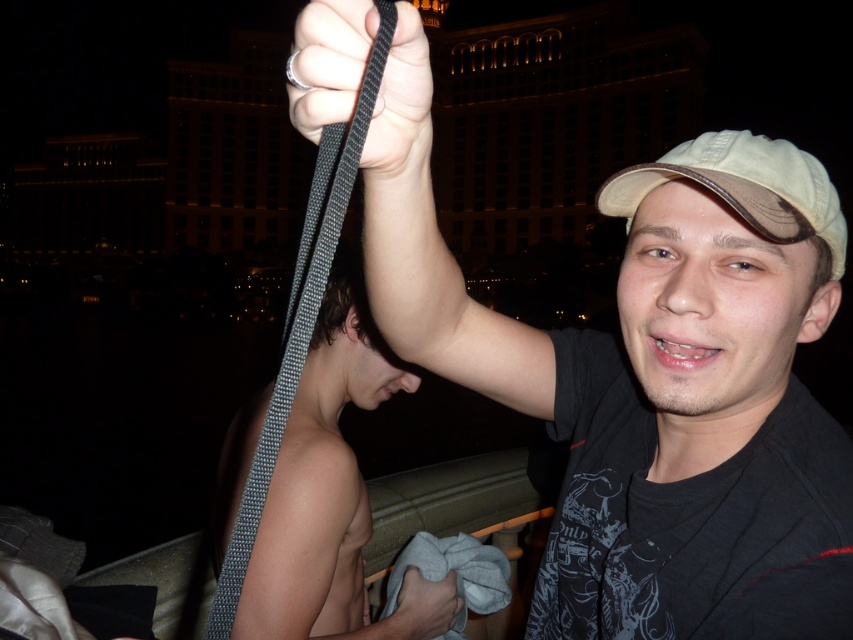
Based on the photo, is black woven strap at upper center closer to camera compared to gray fabric at upper center?

Yes.

Is point (372, 90) positioned before point (431, 596)?

Yes.

Which is in front, point (299, 372) or point (386, 628)?

Positioned in front is point (299, 372).

Image resolution: width=853 pixels, height=640 pixels. In order to click on black woven strap at upper center in this screenshot , I will do `click(300, 316)`.

Measure the distance between black textured strap at upper center and camera.

black textured strap at upper center is 112.21 feet from camera.

Which is in front, point (335, 10) or point (418, 584)?

Positioned in front is point (335, 10).

Find the location of a particular element. Image resolution: width=853 pixels, height=640 pixels. black textured strap at upper center is located at coordinates (329, 61).

Can you confirm if white fabric cap at upper center is smaller than gray fabric at upper center?

Incorrect, white fabric cap at upper center is not smaller in size than gray fabric at upper center.

Is white fabric cap at upper center in front of gray fabric at upper center?

Yes, it is in front of gray fabric at upper center.

Image resolution: width=853 pixels, height=640 pixels. In order to click on white fabric cap at upper center in this screenshot , I will do `click(744, 188)`.